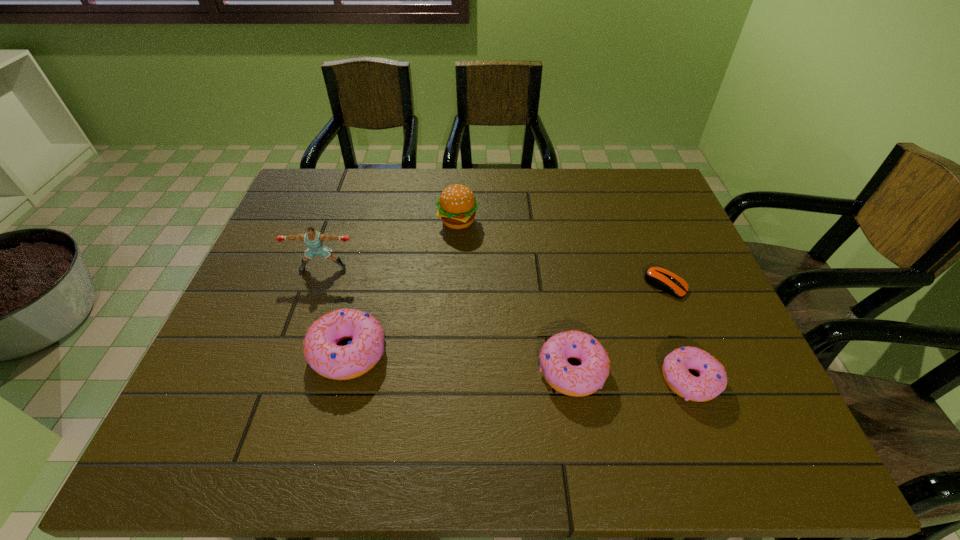
Identify the location of free space that satisfies the following two spatial constraints: 1. on the front-facing side of the tallest object; 2. on the right side of the second tallest doughnut. The image size is (960, 540). (288, 370).

I want to click on free space that satisfies the following two spatial constraints: 1. on the front-facing side of the leftmost doughnut; 2. on the left side of the tallest object, so click(295, 352).